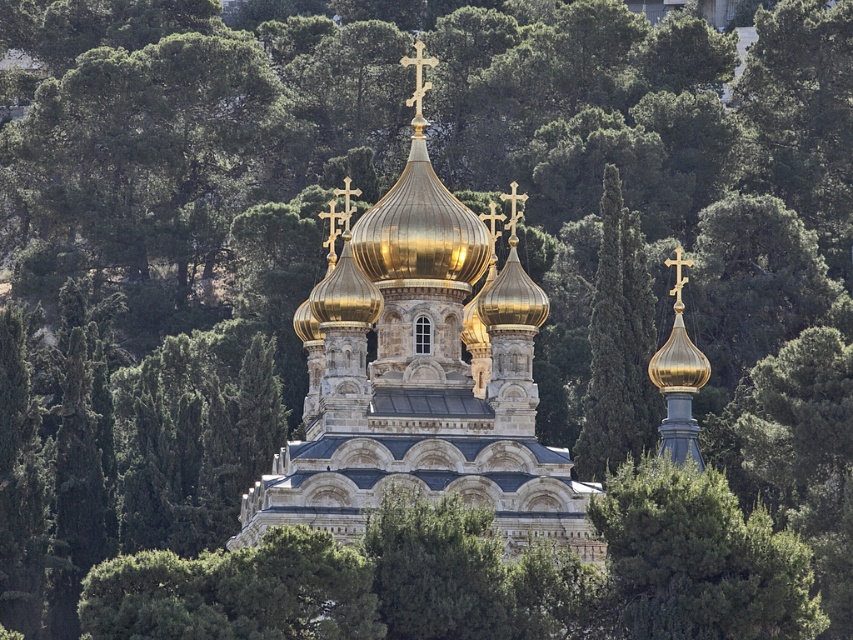
Consider the image. Which of these two, gold stone church at center or green leafy tree at center, stands taller?

gold stone church at center

Describe the element at coordinates (421, 376) in the screenshot. I see `gold stone church at center` at that location.

The image size is (853, 640). Identify the location of gold stone church at center. (421, 376).